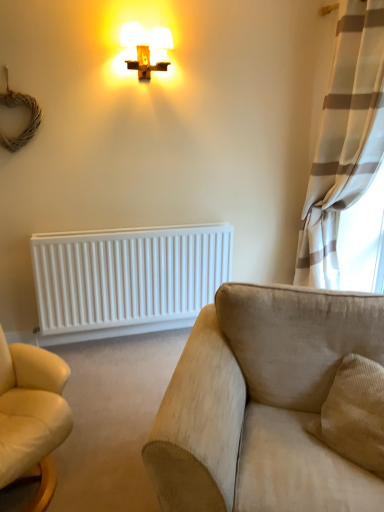
Question: Is beige fabric couch at lower right to the left of white matte radiator at lower left from the viewer's perspective?

Choices:
 (A) yes
 (B) no

Answer: (B)

Question: Is beige fabric couch at lower right shorter than white matte radiator at lower left?

Choices:
 (A) no
 (B) yes

Answer: (B)

Question: Considering the relative sizes of beige fabric couch at lower right and white matte radiator at lower left in the image provided, is beige fabric couch at lower right thinner than white matte radiator at lower left?

Choices:
 (A) no
 (B) yes

Answer: (A)

Question: Does beige fabric couch at lower right lie behind white matte radiator at lower left?

Choices:
 (A) no
 (B) yes

Answer: (A)

Question: Is beige fabric couch at lower right closer to the viewer compared to white matte radiator at lower left?

Choices:
 (A) yes
 (B) no

Answer: (A)

Question: From their relative heights in the image, would you say beige fabric couch at lower right is taller or shorter than matte gold cross at upper center?

Choices:
 (A) tall
 (B) short

Answer: (A)

Question: Looking at the image, does beige fabric couch at lower right seem bigger or smaller compared to matte gold cross at upper center?

Choices:
 (A) small
 (B) big

Answer: (B)

Question: Considering their positions, is beige fabric couch at lower right located in front of or behind matte gold cross at upper center?

Choices:
 (A) behind
 (B) front

Answer: (B)

Question: From a real-world perspective, is beige fabric couch at lower right physically located above or below matte gold cross at upper center?

Choices:
 (A) above
 (B) below

Answer: (B)

Question: Based on their sizes in the image, would you say white matte radiator at lower left is bigger or smaller than white textured curtain at right?

Choices:
 (A) small
 (B) big

Answer: (A)

Question: Does point tap(122, 248) appear closer or farther from the camera than point tap(324, 154)?

Choices:
 (A) farther
 (B) closer

Answer: (A)

Question: From their relative heights in the image, would you say white matte radiator at lower left is taller or shorter than white textured curtain at right?

Choices:
 (A) tall
 (B) short

Answer: (B)

Question: From a real-world perspective, relative to white textured curtain at right, is white matte radiator at lower left vertically above or below?

Choices:
 (A) below
 (B) above

Answer: (A)

Question: Is white matte radiator at lower left wider or thinner than beige fabric couch at lower right?

Choices:
 (A) thin
 (B) wide

Answer: (A)

Question: In the image, is white matte radiator at lower left positioned in front of or behind beige fabric couch at lower right?

Choices:
 (A) front
 (B) behind

Answer: (B)